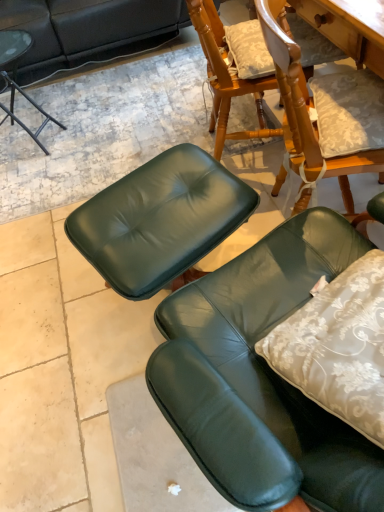
Question: Is green leather chair at lower right, which appears as the 2th chair when viewed from the back, surrounding matte black side table at upper left, which is the 2th chair from bottom to top?

Choices:
 (A) yes
 (B) no

Answer: (B)

Question: Can you confirm if green leather chair at lower right, marked as the second chair in a left-to-right arrangement, is wider than matte black side table at upper left, marked as the second chair in a right-to-left arrangement?

Choices:
 (A) yes
 (B) no

Answer: (B)

Question: From a real-world perspective, is green leather chair at lower right, which is the 2th chair from top to bottom, under matte black side table at upper left, marked as the second chair in a right-to-left arrangement?

Choices:
 (A) yes
 (B) no

Answer: (B)

Question: Is green leather chair at lower right, positioned as the first chair in right-to-left order, behind matte black side table at upper left, positioned as the first chair in top-to-bottom order?

Choices:
 (A) yes
 (B) no

Answer: (B)

Question: Is green leather chair at lower right, which is the 2th chair from top to bottom, bigger than matte black side table at upper left, positioned as the first chair in top-to-bottom order?

Choices:
 (A) yes
 (B) no

Answer: (B)

Question: From a real-world perspective, is green leather chair at lower right, which appears as the 2th chair when viewed from the back, on matte black side table at upper left, the 1th chair when ordered from left to right?

Choices:
 (A) yes
 (B) no

Answer: (A)

Question: Does matte black side table at upper left, marked as the second chair in a right-to-left arrangement, have a greater width compared to green leather chair at lower right, the 1th chair from the bottom?

Choices:
 (A) yes
 (B) no

Answer: (A)

Question: Is matte black side table at upper left, the 1th chair when ordered from left to right, turned away from green leather chair at lower right, which is the first chair from front to back?

Choices:
 (A) no
 (B) yes

Answer: (A)

Question: From a real-world perspective, is matte black side table at upper left, which is the 2th chair from bottom to top, physically below green leather chair at lower right, the 1th chair from the bottom?

Choices:
 (A) yes
 (B) no

Answer: (A)

Question: Is matte black side table at upper left, which appears as the 2th chair when viewed from the front, outside green leather chair at lower right, which is the first chair from front to back?

Choices:
 (A) no
 (B) yes

Answer: (B)

Question: From the image's perspective, is matte black side table at upper left, marked as the second chair in a right-to-left arrangement, under green leather chair at lower right, which is the 2th chair from top to bottom?

Choices:
 (A) no
 (B) yes

Answer: (A)

Question: Would you consider matte black side table at upper left, the 1th chair when ordered from left to right, to be distant from green leather chair at lower right, which appears as the 2th chair when viewed from the back?

Choices:
 (A) yes
 (B) no

Answer: (A)

Question: Considering the positions of green leather chair at lower right, marked as the second chair in a left-to-right arrangement, and matte black side table at upper left, which appears as the 2th chair when viewed from the front, in the image, is green leather chair at lower right, marked as the second chair in a left-to-right arrangement, wider or thinner than matte black side table at upper left, which appears as the 2th chair when viewed from the front,?

Choices:
 (A) wide
 (B) thin

Answer: (B)